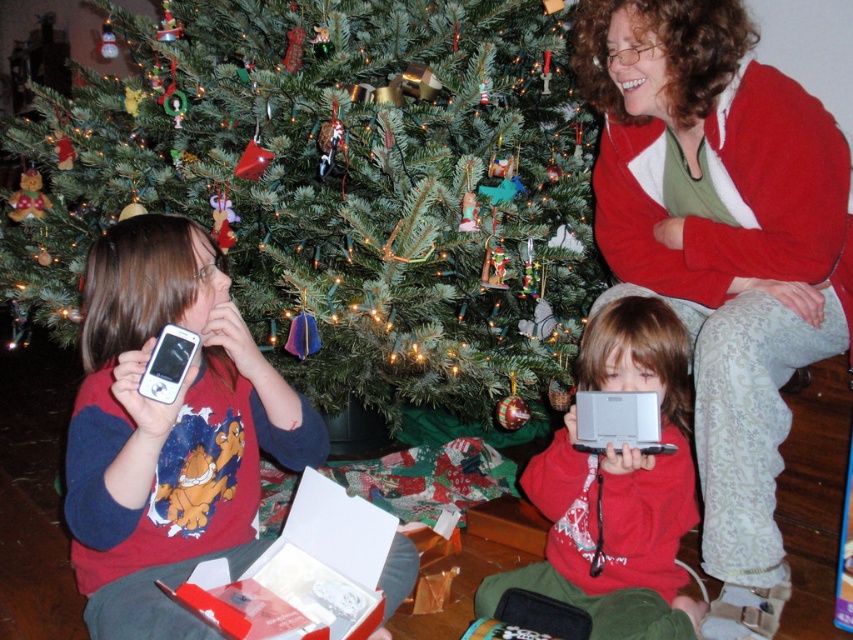
What do you see at coordinates (722, 250) in the screenshot?
I see `red sweater at center` at bounding box center [722, 250].

Is red sweater at center thinner than silver metallic handheld device at center?

No, red sweater at center is not thinner than silver metallic handheld device at center.

Between point (636, 104) and point (633, 317), which one is positioned in front?

Point (633, 317) is in front.

Locate an element on the screen. The image size is (853, 640). red sweater at center is located at coordinates (722, 250).

I want to click on green matte christmas tree at center, so click(340, 186).

Can you confirm if green matte christmas tree at center is thinner than red sweater at center?

No.

Who is more forward, (117,20) or (642,202)?

Point (642,202) is more forward.

The height and width of the screenshot is (640, 853). In order to click on green matte christmas tree at center in this screenshot , I will do `click(340, 186)`.

Can you confirm if green matte christmas tree at center is taller than silver metallic handheld device at center?

Correct, green matte christmas tree at center is much taller as silver metallic handheld device at center.

Who is more distant from viewer, (306, 230) or (637, 509)?

The point (306, 230) is behind.

Which is behind, point (318, 4) or point (474, 592)?

The point (474, 592) is more distant.

Find the location of `green matte christmas tree at center`. green matte christmas tree at center is located at coordinates (x=340, y=186).